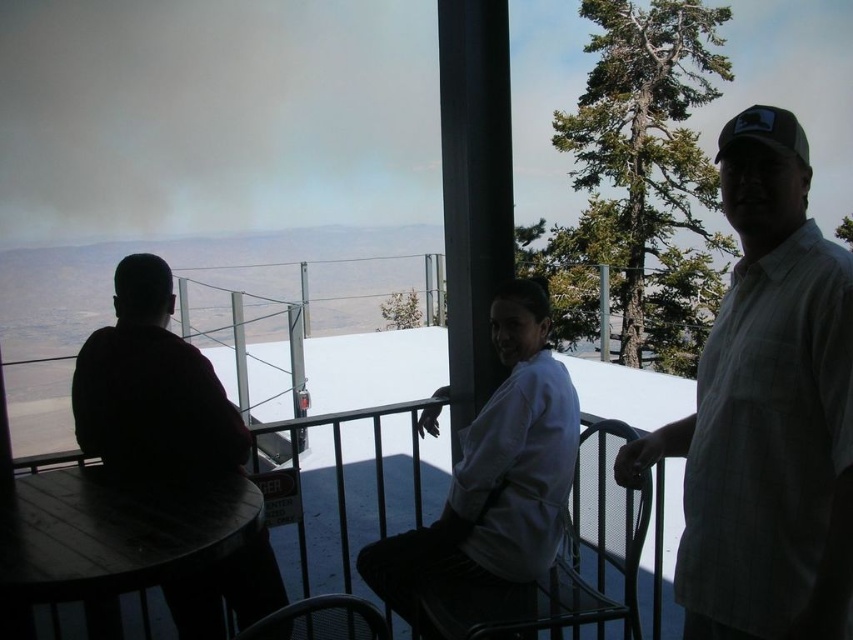
Question: Among these points, which one is nearest to the camera?

Choices:
 (A) (544, 531)
 (B) (834, 637)
 (C) (53, 540)

Answer: (B)

Question: Is white checkered shirt at right wider than white cotton shirt at center?

Choices:
 (A) yes
 (B) no

Answer: (B)

Question: Can you confirm if dark matte shirt at left is thinner than wooden table at center?

Choices:
 (A) yes
 (B) no

Answer: (A)

Question: Based on their relative distances, which object is farther from the white checkered shirt at right?

Choices:
 (A) white cotton shirt at center
 (B) dark matte shirt at left
 (C) wooden table at center

Answer: (B)

Question: Which point appears closest to the camera in this image?

Choices:
 (A) (196, 429)
 (B) (770, 116)
 (C) (96, 588)
 (D) (453, 557)

Answer: (B)

Question: Does white checkered shirt at right have a smaller size compared to wooden table at center?

Choices:
 (A) no
 (B) yes

Answer: (A)